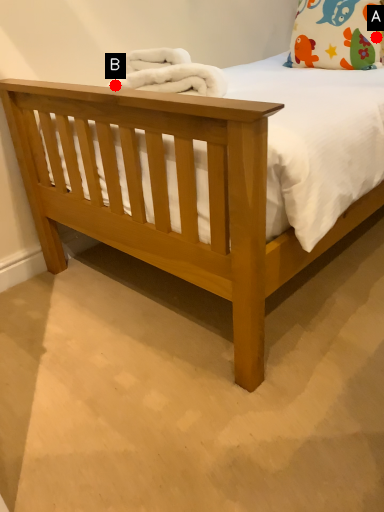
Question: Two points are circled on the image, labeled by A and B beside each circle. Which point appears farthest from the camera in this image?

Choices:
 (A) A is further
 (B) B is further

Answer: (A)